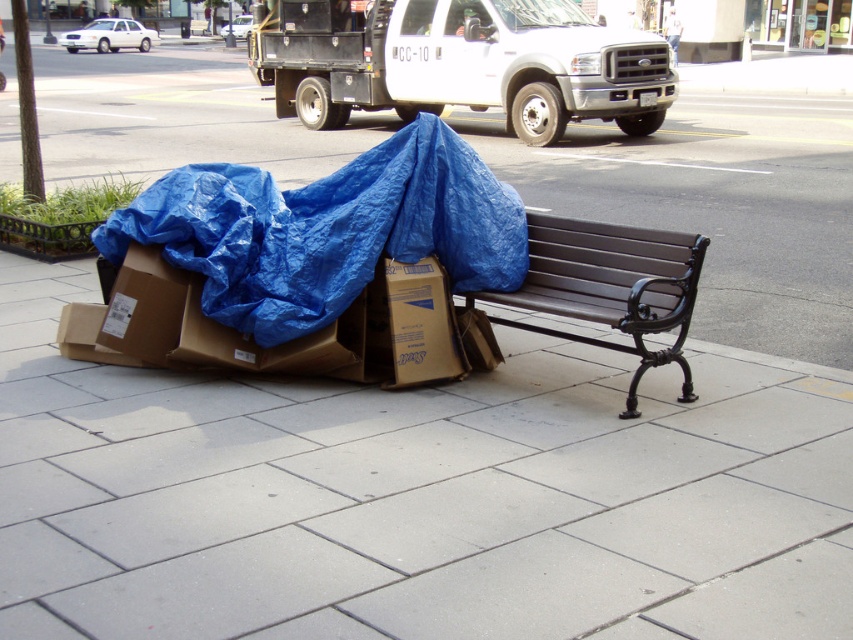
Is blue tarp at lower left bigger than brown wooden bench at center?

Correct, blue tarp at lower left is larger in size than brown wooden bench at center.

Is blue tarp at lower left positioned behind brown wooden bench at center?

Yes, blue tarp at lower left is further from the viewer.

What are the coordinates of `blue tarp at lower left` in the screenshot? It's located at (328, 228).

What do you see at coordinates (416, 496) in the screenshot?
I see `smooth concrete pavement at lower center` at bounding box center [416, 496].

Does point (711, 403) lie behind point (438, 291)?

No, (711, 403) is in front of (438, 291).

Where is `smooth concrete pavement at lower center`? smooth concrete pavement at lower center is located at coordinates (416, 496).

Which is below, blue tarp at lower left or brown cardboard box at lower center?

brown cardboard box at lower center is below.

Between blue tarp at lower left and brown cardboard box at lower center, which one has less height?

brown cardboard box at lower center is shorter.

What do you see at coordinates (328, 228) in the screenshot?
I see `blue tarp at lower left` at bounding box center [328, 228].

You are a GUI agent. You are given a task and a screenshot of the screen. Output one action in this format:
    pyautogui.click(x=<x>, y=<y>)
    Task: Click on the blue tarp at lower left
    Image resolution: width=853 pixels, height=640 pixels.
    Given the screenshot: What is the action you would take?
    pyautogui.click(x=328, y=228)